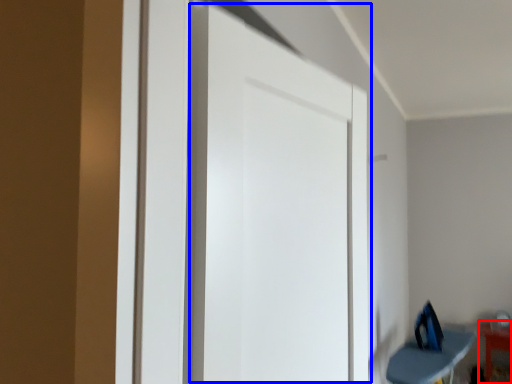
Question: Among these objects, which one is nearest to the camera, furniture (highlighted by a red box) or door (highlighted by a blue box)?

Choices:
 (A) furniture
 (B) door

Answer: (B)